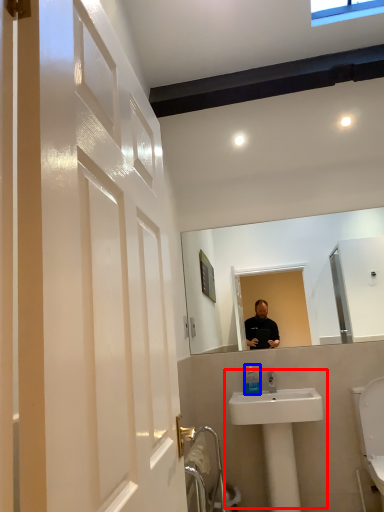
Question: Which object is closer to the camera taking this photo, sink (highlighted by a red box) or toiletry (highlighted by a blue box)?

Choices:
 (A) sink
 (B) toiletry

Answer: (A)